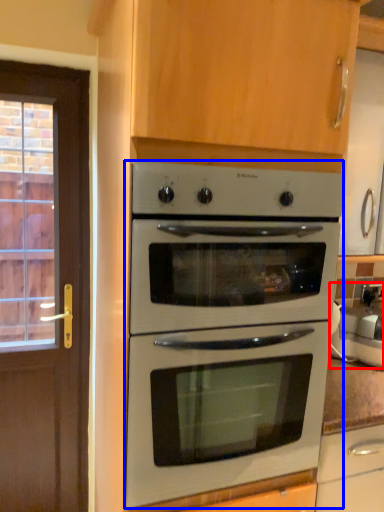
Question: Which of the following is the closest to the observer, appliance (highlighted by a red box) or oven (highlighted by a blue box)?

Choices:
 (A) appliance
 (B) oven

Answer: (B)